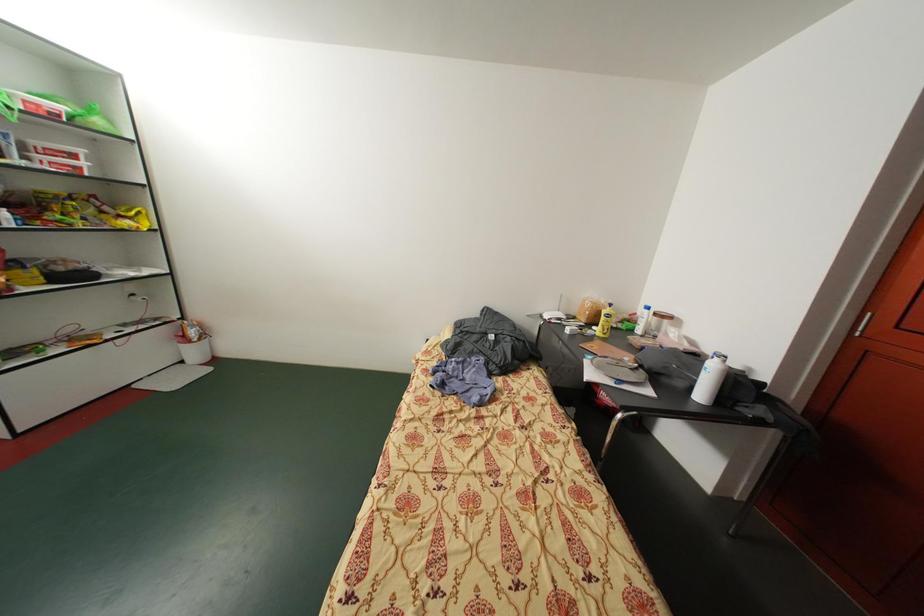
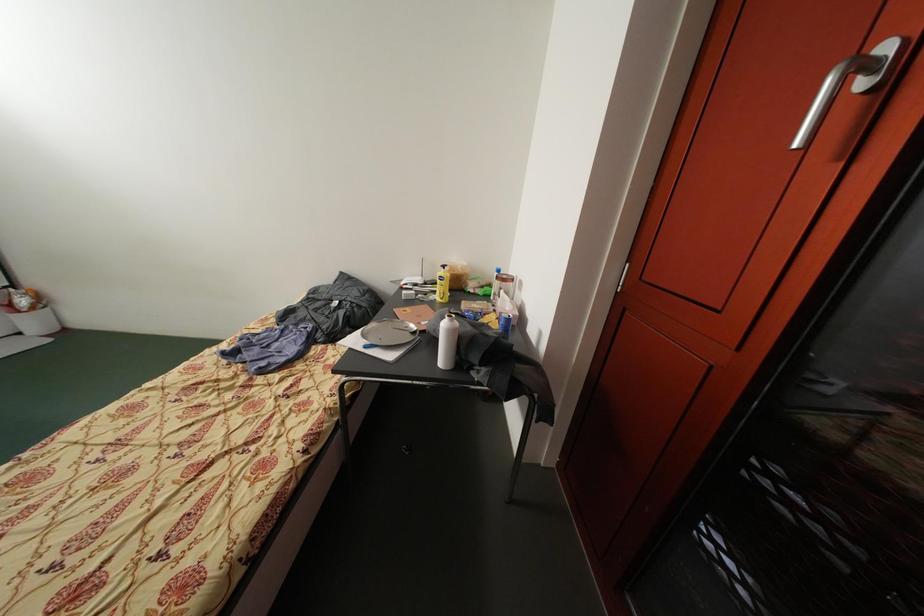
Question: What movement of the cameraman would produce the second image?

Choices:
 (A) Left
 (B) Right
 (C) Forward
 (D) Backward

Answer: (B)